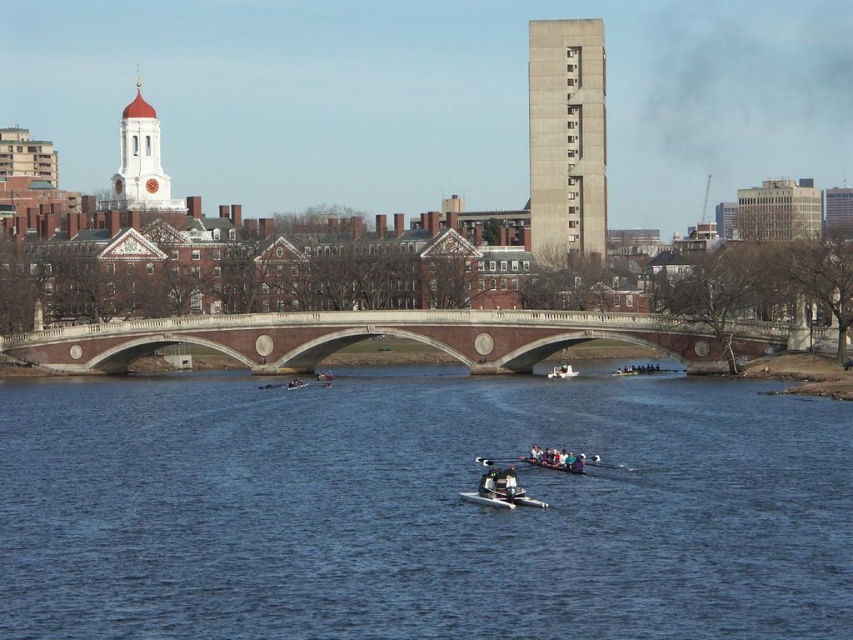
In the scene shown: You are a spectator standing on the red brick bridge with white stone railings and you see the white glossy rowboat at center and the matte black rowboat at center. Which boat is closer to the water surface?

The white glossy rowboat at center is closer to the water surface because it is located below the matte black rowboat at center.

You are a photographer standing at the riverside with a camera. You want to capture a closeup shot of the white glossy rowboat at center. Given that the camera can only focus on objects within 50 meters, will you be able to take the photo without moving closer?

The white glossy rowboat at center is 78.59 meters from the camera, which is beyond the camera focus range of 50 meters. Therefore, you cannot take a clear closeup photo without moving closer.